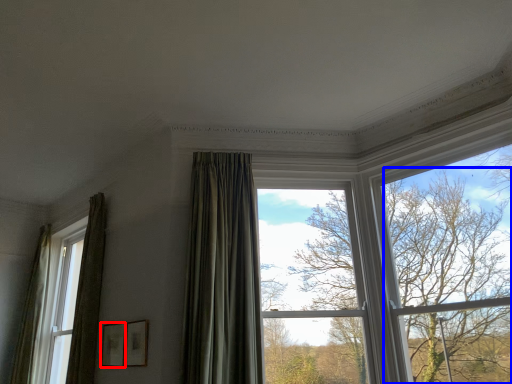
Question: Which point is closer to the camera, picture frame (highlighted by a red box) or tree (highlighted by a blue box)?

Choices:
 (A) picture frame
 (B) tree

Answer: (B)